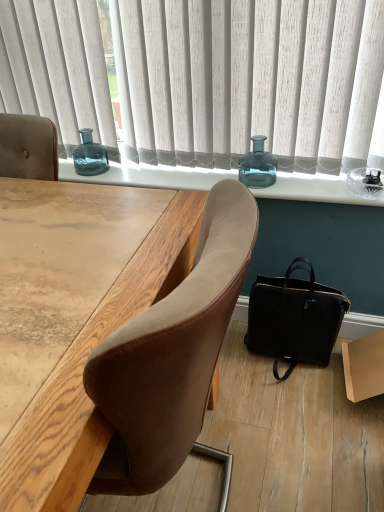
Where is `free point to the right of teal glass bottle at upper center, the first bottle viewed from the left`? This screenshot has height=512, width=384. free point to the right of teal glass bottle at upper center, the first bottle viewed from the left is located at coordinates (140, 168).